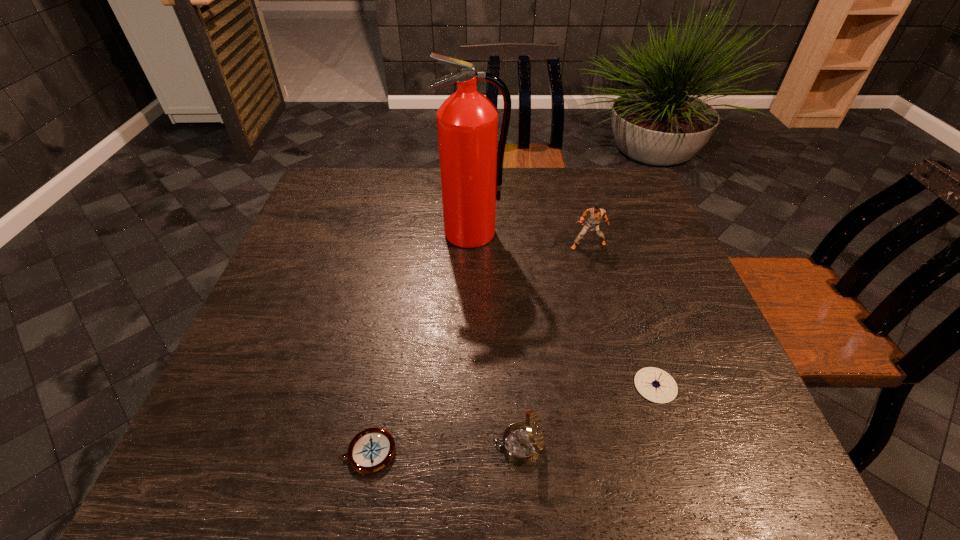
You are a GUI agent. You are given a task and a screenshot of the screen. Output one action in this format:
    pyautogui.click(x=<x>, y=<y>)
    Task: Click on the fire extinguisher
    
    Given the screenshot: What is the action you would take?
    pyautogui.click(x=471, y=168)

This screenshot has width=960, height=540. Find the location of `the second tallest object`. the second tallest object is located at coordinates (595, 214).

The width and height of the screenshot is (960, 540). I want to click on the tallest compass, so click(521, 442).

This screenshot has width=960, height=540. Identify the location of the second compass from right to left. (521, 442).

This screenshot has height=540, width=960. Identify the location of the second shortest compass. (656, 385).

The height and width of the screenshot is (540, 960). Identify the location of the rightmost compass. click(656, 385).

Image resolution: width=960 pixels, height=540 pixels. Identify the location of the shortest compass. (371, 450).

You are a GUI agent. You are given a task and a screenshot of the screen. Output one action in this format:
    pyautogui.click(x=<x>, y=<y>)
    Task: Click on the leftmost compass
    This screenshot has height=540, width=960.
    Given the screenshot: What is the action you would take?
    pyautogui.click(x=371, y=450)

Locate an element on the screen. free region located at the nozzle of the tallest object is located at coordinates (470, 312).

Find the location of a particular element. vacant space located 0.100m on the front-facing side of the puncher is located at coordinates click(597, 278).